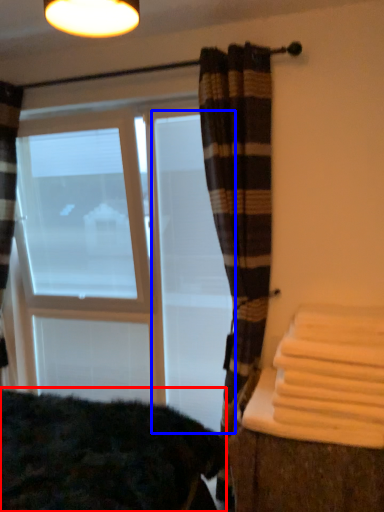
Question: Which of the following is the closest to the observer, bedding (highlighted by a red box) or screen door (highlighted by a blue box)?

Choices:
 (A) bedding
 (B) screen door

Answer: (A)